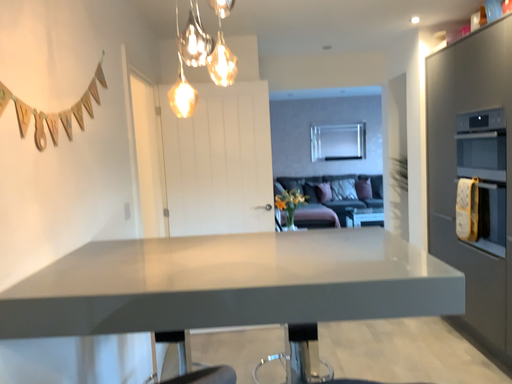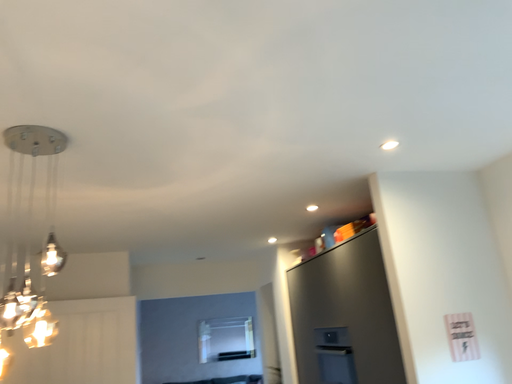
Question: Which way did the camera rotate in the video?

Choices:
 (A) rotated left
 (B) rotated right

Answer: (B)